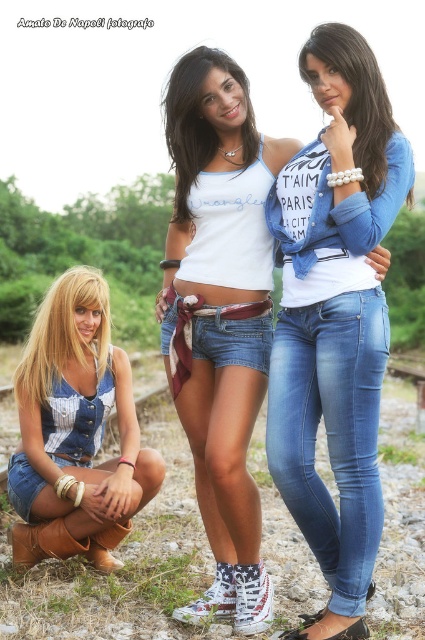
Question: Which of the following is the closest to the observer?

Choices:
 (A) (98, 300)
 (B) (308, 396)
 (C) (294, 636)

Answer: (C)

Question: Is denim jeans at center thinner than blue denim jeans at center?

Choices:
 (A) no
 (B) yes

Answer: (A)

Question: Can you confirm if denim jeans at center is bigger than denim shorts at lower left?

Choices:
 (A) no
 (B) yes

Answer: (A)

Question: Which is nearer to the denim jeans at center?

Choices:
 (A) denim shorts at lower left
 (B) blue denim jeans at center

Answer: (B)

Question: Which of the following is the closest to the observer?

Choices:
 (A) blue denim jeans at center
 (B) denim jeans at center

Answer: (B)

Question: In this image, where is denim jeans at center located relative to denim shorts at lower left?

Choices:
 (A) right
 (B) left

Answer: (A)